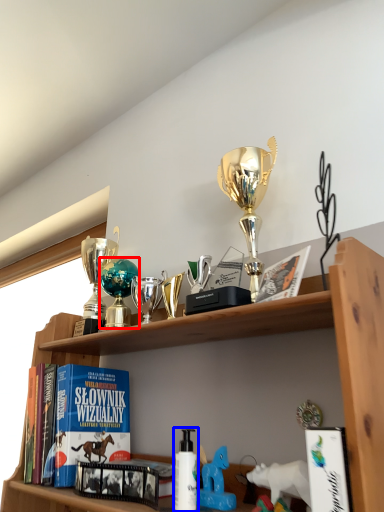
Question: Which object appears closest to the camera in this image, toy (highlighted by a red box) or bottle (highlighted by a blue box)?

Choices:
 (A) toy
 (B) bottle

Answer: (B)